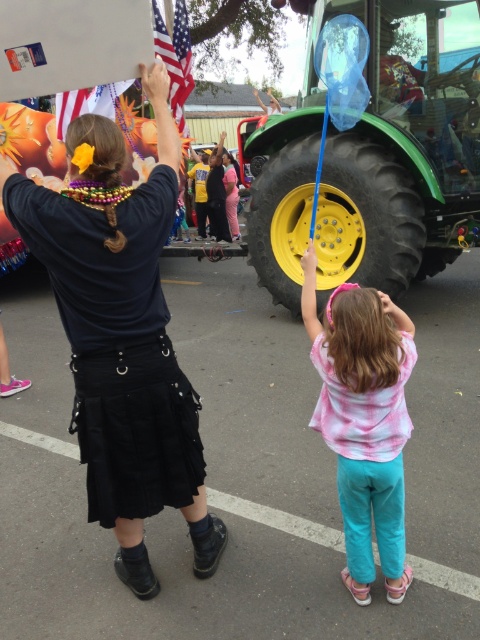
Between black leather skirt at center and american flag at upper left, which one appears on the left side from the viewer's perspective?

From the viewer's perspective, black leather skirt at center appears more on the left side.

Is point (144, 337) positioned after point (172, 44)?

That is False.

The image size is (480, 640). In order to click on black leather skirt at center in this screenshot , I will do `click(121, 333)`.

Is green rubber tractor at center closer to the viewer compared to american flag at upper left?

No, green rubber tractor at center is further to the viewer.

This screenshot has width=480, height=640. I want to click on green rubber tractor at center, so click(370, 168).

Which is more to the left, pink tie-dye shirt at center or american flag at upper left?

american flag at upper left is more to the left.

Is pink tie-dye shirt at center below american flag at upper left?

Correct, pink tie-dye shirt at center is located below american flag at upper left.

The width and height of the screenshot is (480, 640). In order to click on pink tie-dye shirt at center in this screenshot , I will do `click(363, 420)`.